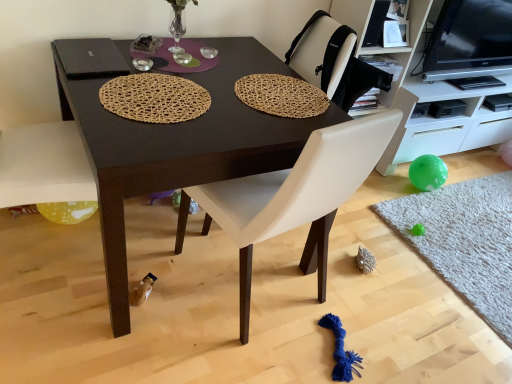
Question: Is dark brown wood table at center touching white leather chair at center?

Choices:
 (A) no
 (B) yes

Answer: (A)

Question: From a real-world perspective, is dark brown wood table at center over white leather chair at center?

Choices:
 (A) no
 (B) yes

Answer: (A)

Question: Does dark brown wood table at center have a larger size compared to white leather chair at center?

Choices:
 (A) no
 (B) yes

Answer: (B)

Question: Is white leather chair at center completely or partially inside dark brown wood table at center?

Choices:
 (A) yes
 (B) no

Answer: (A)

Question: Is dark brown wood table at center positioned in front of white leather chair at center?

Choices:
 (A) no
 (B) yes

Answer: (A)

Question: Is point coord(147,120) closer or farther from the camera than point coord(331,6)?

Choices:
 (A) farther
 (B) closer

Answer: (B)

Question: From the image's perspective, is woven natural mat at center, which is the 2th mat in bottom-to-top order, located above or below white glossy cabinet at right?

Choices:
 (A) above
 (B) below

Answer: (B)

Question: Is woven natural mat at center, arranged as the first mat when viewed from the front, in front of or behind white glossy cabinet at right in the image?

Choices:
 (A) front
 (B) behind

Answer: (A)

Question: Is woven natural mat at center, the 2th mat positioned from the top, to the left or to the right of white glossy cabinet at right in the image?

Choices:
 (A) left
 (B) right

Answer: (A)

Question: Do you think translucent yellow balloon at lower left is within woven natural mat at upper center, the 1th mat when ordered from top to bottom, or outside of it?

Choices:
 (A) inside
 (B) outside

Answer: (B)

Question: From a real-world perspective, is translucent yellow balloon at lower left above or below woven natural mat at upper center, which is the second mat in right-to-left order?

Choices:
 (A) above
 (B) below

Answer: (B)

Question: From the image's perspective, is translucent yellow balloon at lower left above or below woven natural mat at upper center, acting as the second mat starting from the front?

Choices:
 (A) above
 (B) below

Answer: (B)

Question: Considering the relative positions of translucent yellow balloon at lower left and woven natural mat at upper center, acting as the second mat starting from the front, in the image provided, is translucent yellow balloon at lower left to the left or to the right of woven natural mat at upper center, acting as the second mat starting from the front,?

Choices:
 (A) left
 (B) right

Answer: (A)

Question: Is white leather chair at center situated inside woven natural mat at upper center, the 1th mat when ordered from top to bottom, or outside?

Choices:
 (A) outside
 (B) inside

Answer: (A)

Question: Visually, is white leather chair at center positioned to the left or to the right of woven natural mat at upper center, which is the second mat in right-to-left order?

Choices:
 (A) left
 (B) right

Answer: (A)